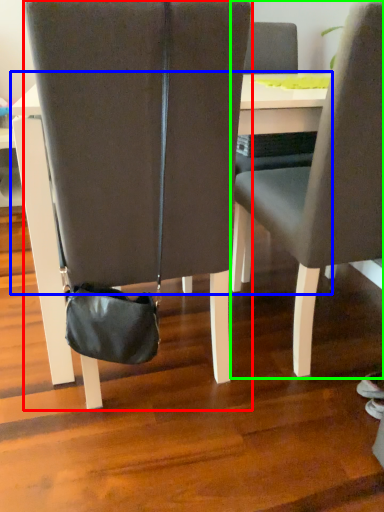
Question: Which is nearer to the chair (highlighted by a red box)? table (highlighted by a blue box) or chair (highlighted by a green box).

Choices:
 (A) table
 (B) chair

Answer: (A)